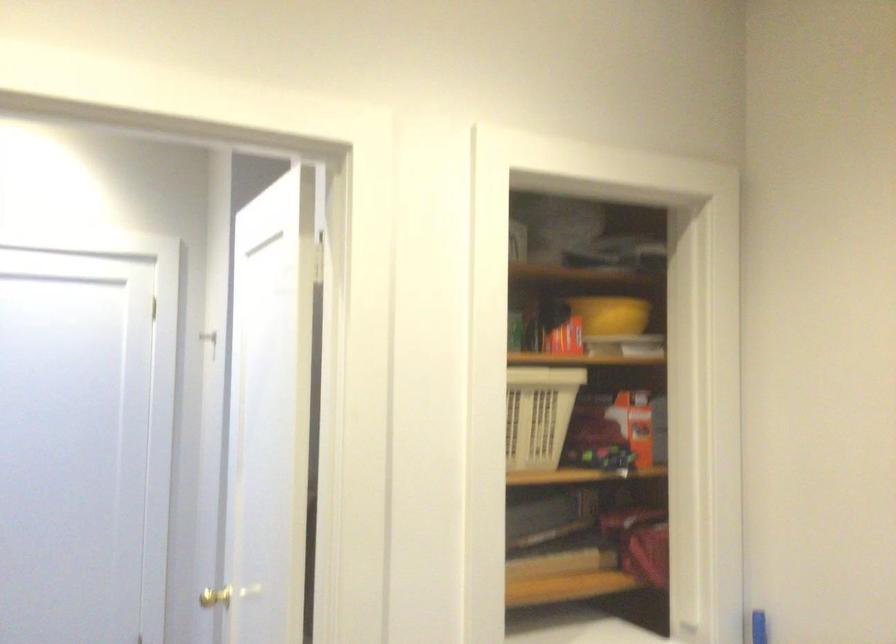
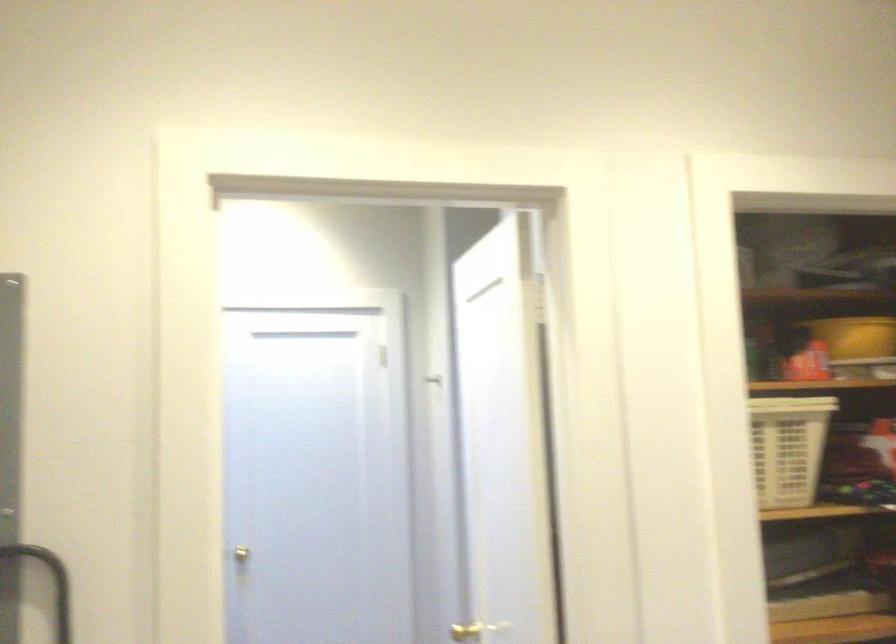
Question: The images are taken continuously from a first-person perspective. In which direction is your viewpoint rotating?

Choices:
 (A) Left
 (B) Right
 (C) Up
 (D) Down

Answer: (A)